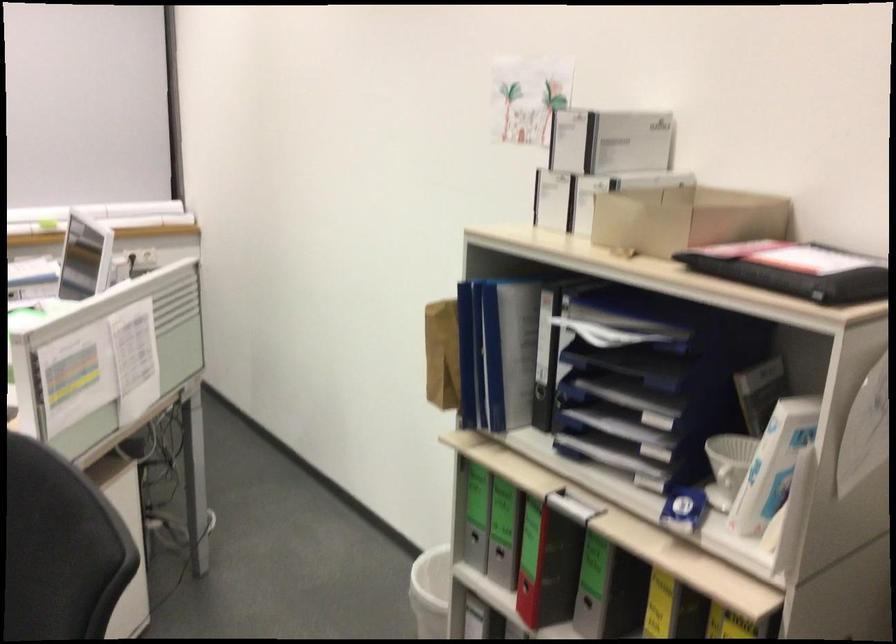
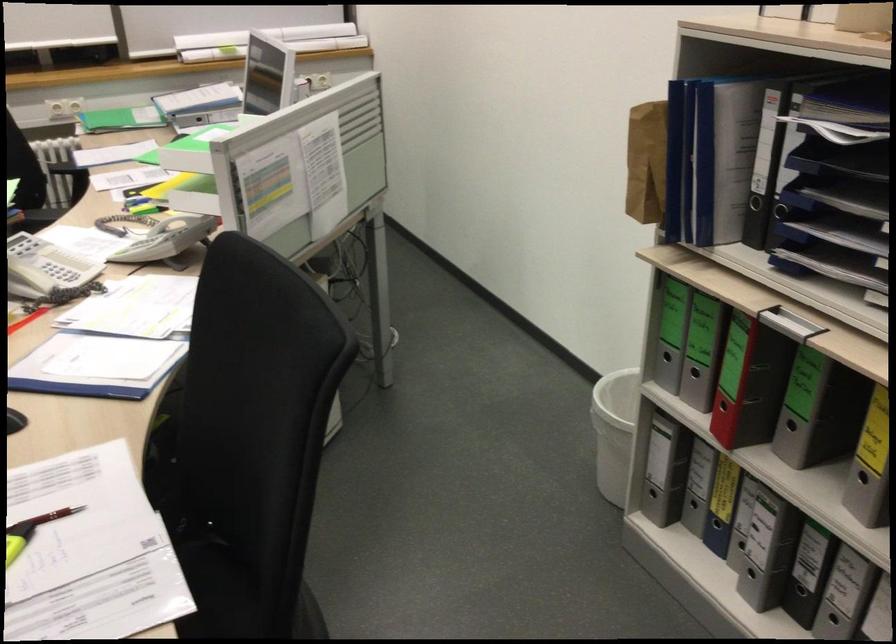
Locate, in the second image, the point that corresponds to (543,391) in the first image.

(754, 203)